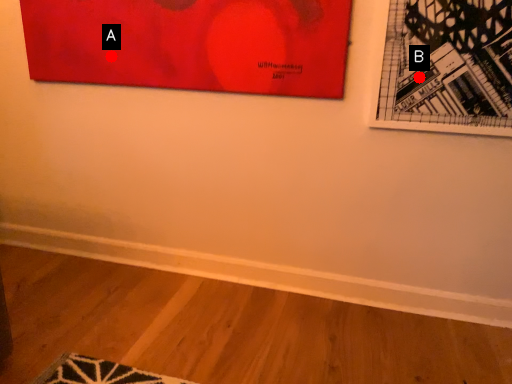
Question: Two points are circled on the image, labeled by A and B beside each circle. Which point appears closest to the camera in this image?

Choices:
 (A) A is closer
 (B) B is closer

Answer: (B)